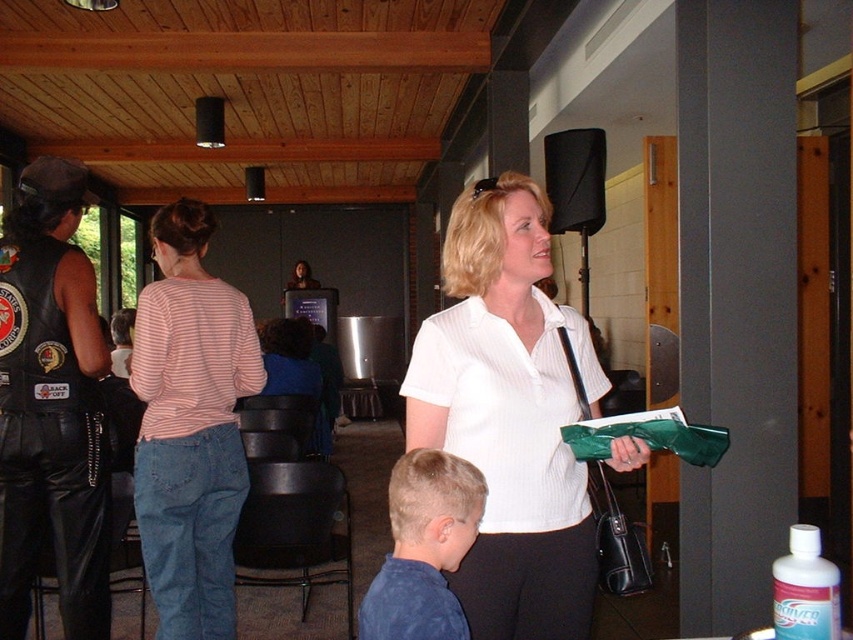
Question: In this image, where is pink striped shirt at center located relative to blue cotton shirt at lower center?

Choices:
 (A) right
 (B) left

Answer: (B)

Question: Which of the following is the closest to the observer?

Choices:
 (A) (463, 432)
 (B) (142, 324)
 (C) (633, 419)

Answer: (C)

Question: Which is nearer to the white ribbed shirt at center?

Choices:
 (A) blue cotton shirt at lower center
 (B) green plastic clipboard at center
 (C) pink striped shirt at center
 (D) white pinstriped shirt at center

Answer: (D)

Question: Is pink striped shirt at center closer to camera compared to white pinstriped shirt at center?

Choices:
 (A) yes
 (B) no

Answer: (B)

Question: Which point is closer to the camera taking this photo?

Choices:
 (A) (485, 529)
 (B) (699, 429)

Answer: (B)

Question: Is pink striped shirt at center bigger than green plastic clipboard at center?

Choices:
 (A) no
 (B) yes

Answer: (B)